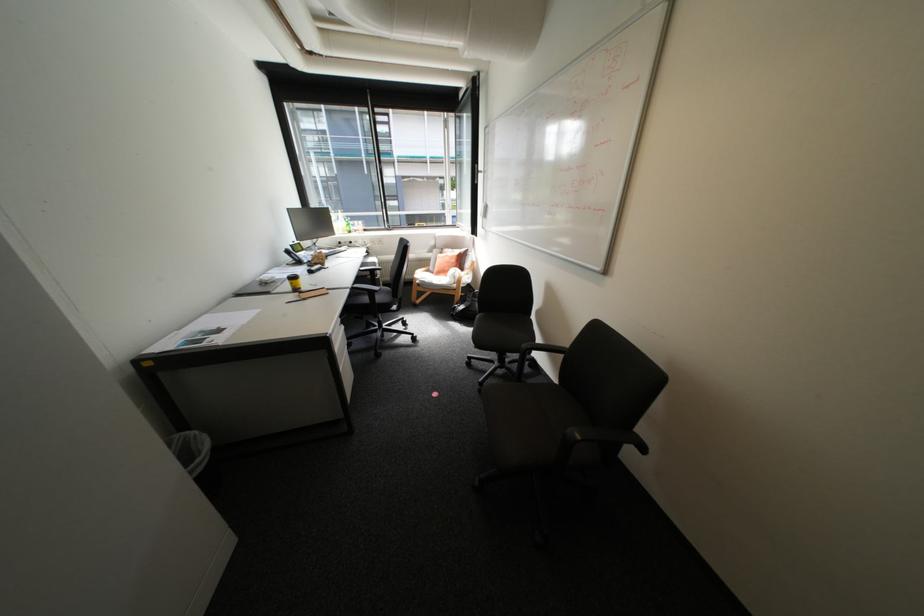
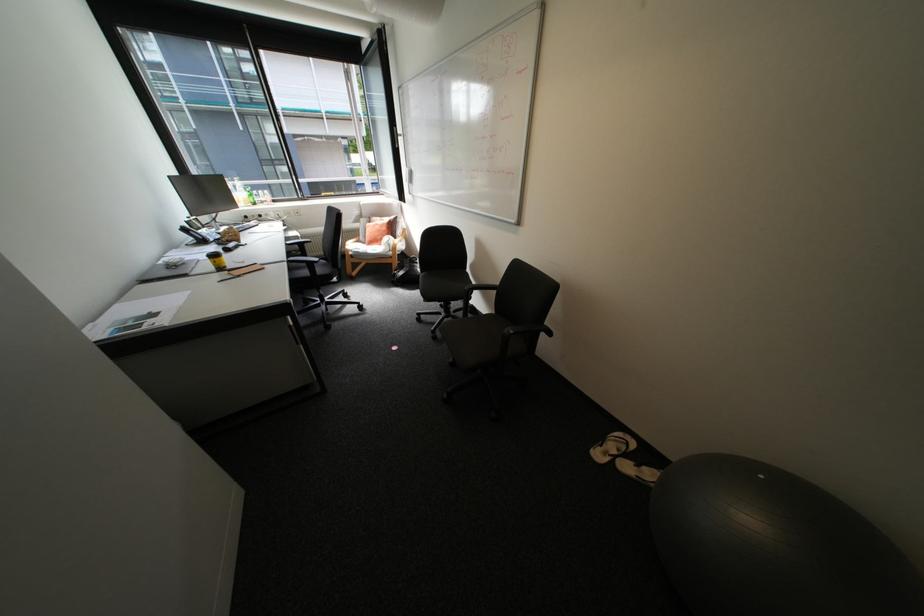
Find the pixel in the second image that matches point 297,252 in the first image.

(195, 230)